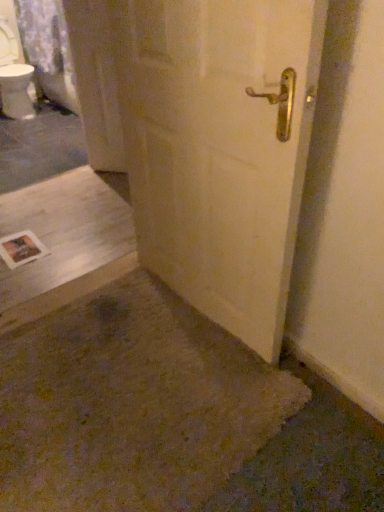
Question: Considering their positions, is white matte door at center located in front of or behind white concrete at lower left?

Choices:
 (A) behind
 (B) front

Answer: (B)

Question: Is white matte door at center bigger or smaller than white concrete at lower left?

Choices:
 (A) small
 (B) big

Answer: (B)

Question: In terms of height, does white matte door at center look taller or shorter compared to white concrete at lower left?

Choices:
 (A) tall
 (B) short

Answer: (A)

Question: Which is correct: white concrete at lower left is inside white matte door at center, or outside of it?

Choices:
 (A) outside
 (B) inside

Answer: (A)

Question: From a real-world perspective, relative to white matte door at center, is white concrete at lower left vertically above or below?

Choices:
 (A) below
 (B) above

Answer: (A)

Question: Is white concrete at lower left in front of or behind white matte door at center in the image?

Choices:
 (A) front
 (B) behind

Answer: (B)

Question: Is point (64, 200) positioned closer to the camera than point (244, 144)?

Choices:
 (A) closer
 (B) farther

Answer: (B)